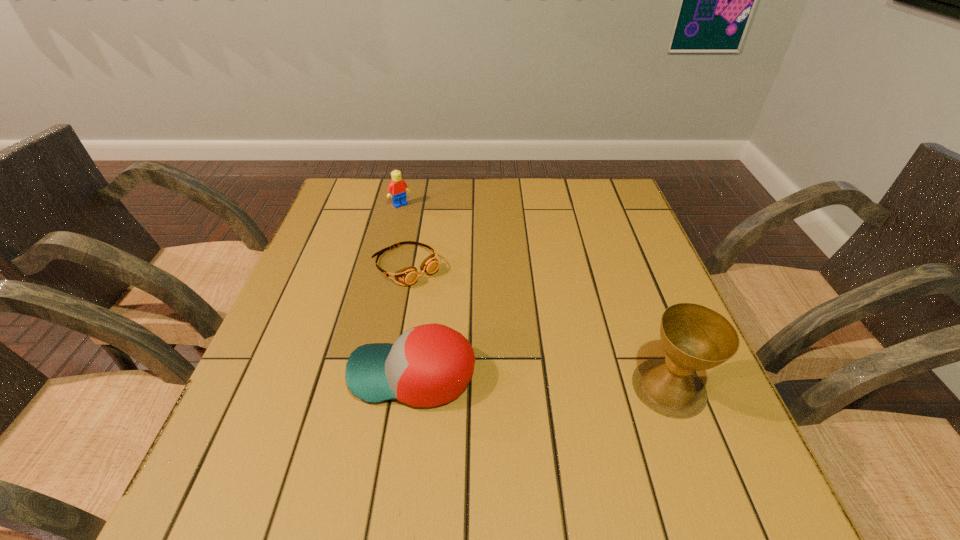
Where is `vacant space located 0.380m on the face of the farthest object`? Image resolution: width=960 pixels, height=540 pixels. vacant space located 0.380m on the face of the farthest object is located at coordinates (472, 282).

This screenshot has height=540, width=960. What are the coordinates of `free space located 0.210m on the face of the farthest object` in the screenshot? It's located at (439, 245).

You are a GUI agent. You are given a task and a screenshot of the screen. Output one action in this format:
    pyautogui.click(x=<x>, y=<y>)
    Task: Click on the vacant area situated on the face of the farthest object
    Image resolution: width=960 pixels, height=540 pixels.
    Given the screenshot: What is the action you would take?
    tap(414, 218)

Find the location of a particular element. vacant space located with the lenses facing forward on the shortest object is located at coordinates tap(503, 356).

In order to click on vacant space located 0.170m with the lenses facing forward on the shortest object in this screenshot , I will do `click(469, 325)`.

Where is `vacant region located with the lenses facing forward on the shortest object`? vacant region located with the lenses facing forward on the shortest object is located at coordinates (503, 356).

Where is `object present at the far edge`? object present at the far edge is located at coordinates (397, 189).

The image size is (960, 540). I want to click on baseball cap located at the near edge, so click(x=429, y=365).

Locate an element on the screen. chalice that is at the near edge is located at coordinates (694, 337).

You are a GUI agent. You are given a task and a screenshot of the screen. Output one action in this format:
    pyautogui.click(x=<x>, y=<y>)
    Task: Click on the object present at the right edge
    The height and width of the screenshot is (540, 960).
    Given the screenshot: What is the action you would take?
    pyautogui.click(x=694, y=337)